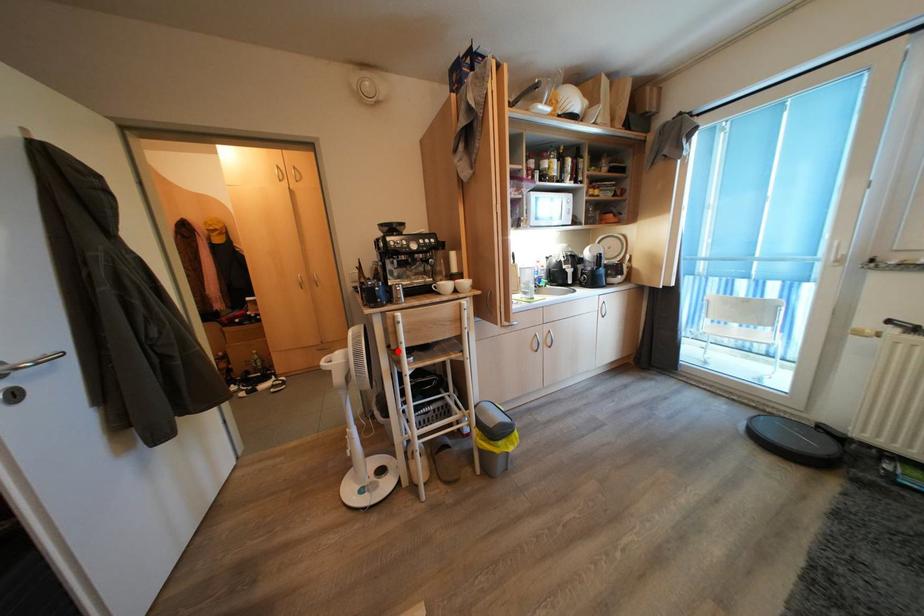
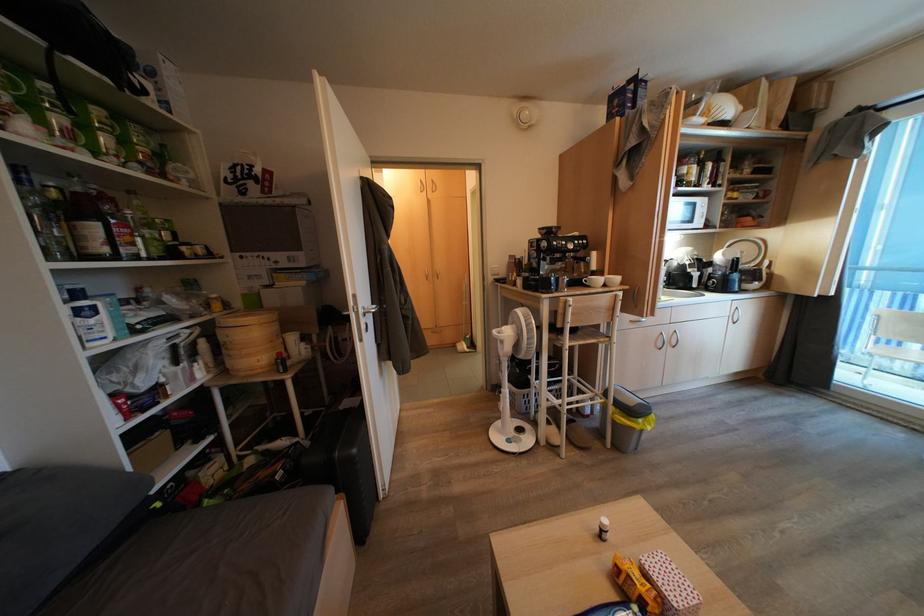
The point at the highlighted location is marked in the first image. Where is the corresponding point in the second image?

(564, 330)